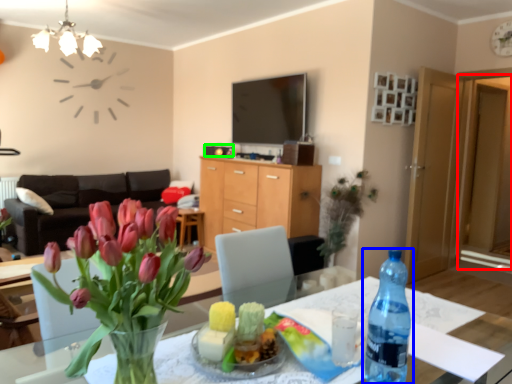
Question: Estimate the real-world distances between objects in this image. Which object is closer to glass door (highlighted by a red box), bottle (highlighted by a blue box) or corded phone (highlighted by a green box)?

Choices:
 (A) bottle
 (B) corded phone

Answer: (B)